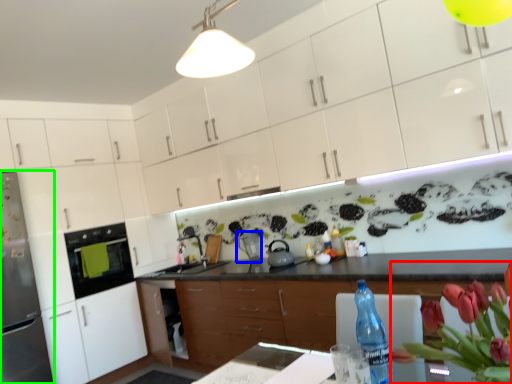
Question: Based on their relative distances, which object is farther from floral arrangement (highlighted by a red box)? Choose from appliance (highlighted by a blue box) and refrigerator (highlighted by a green box).

Choices:
 (A) appliance
 (B) refrigerator

Answer: (B)